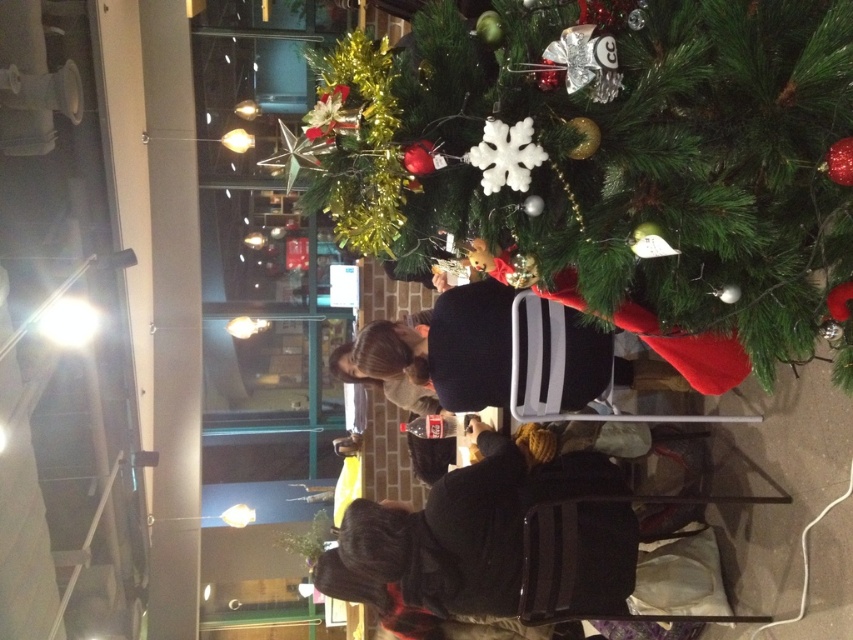
Based on the photo, does green matte christmas tree at center have a lesser width compared to dark brown sweater at center?

Indeed, green matte christmas tree at center has a lesser width compared to dark brown sweater at center.

Between point (502, 204) and point (381, 344), which one is positioned in front?

Positioned in front is point (502, 204).

The image size is (853, 640). In order to click on green matte christmas tree at center in this screenshot , I will do `click(618, 154)`.